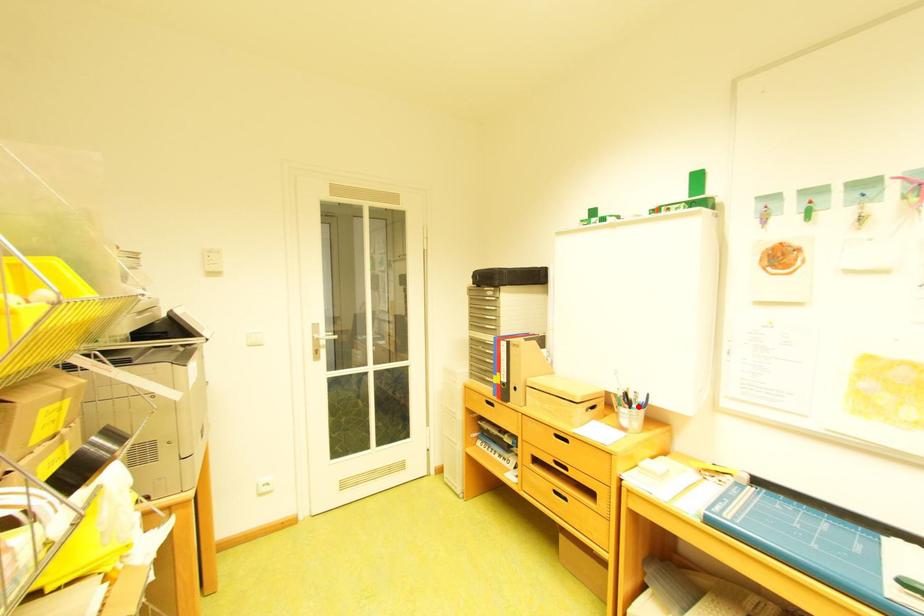
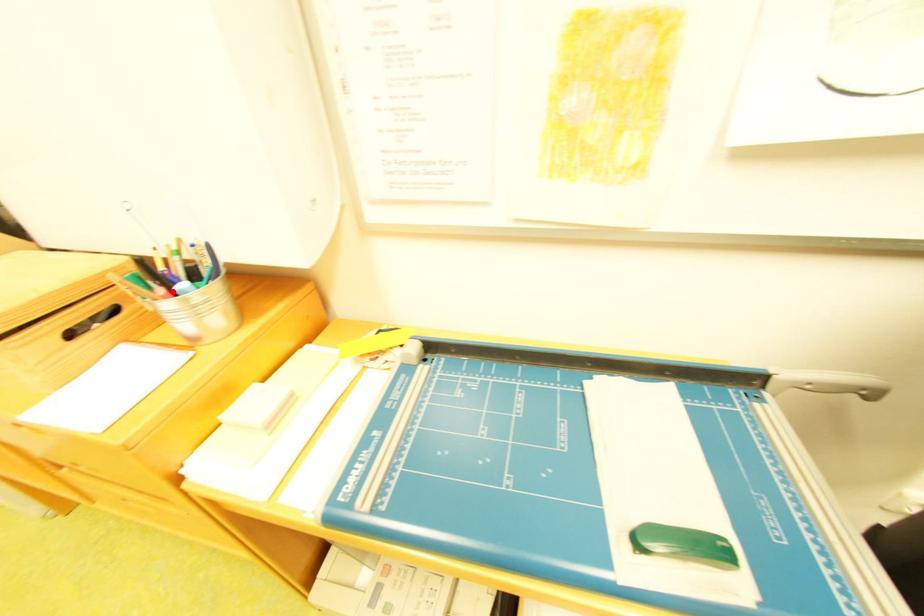
I am providing you with two images of the same scene from different viewpoints. A red point is marked on the first image and another point is marked on the second image. Is the red point in image1 aligned with the point shown in image2?

Yes